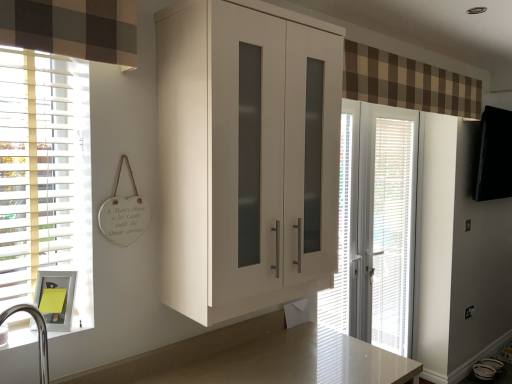
You are a GUI agent. You are given a task and a screenshot of the screen. Output one action in this format:
    pyautogui.click(x=<x>, y=<y>)
    Task: Click on the vacant location below white glossy cabinet at center (from a real-world perspective)
    Image resolution: width=512 pixels, height=384 pixels.
    Given the screenshot: What is the action you would take?
    pyautogui.click(x=260, y=356)